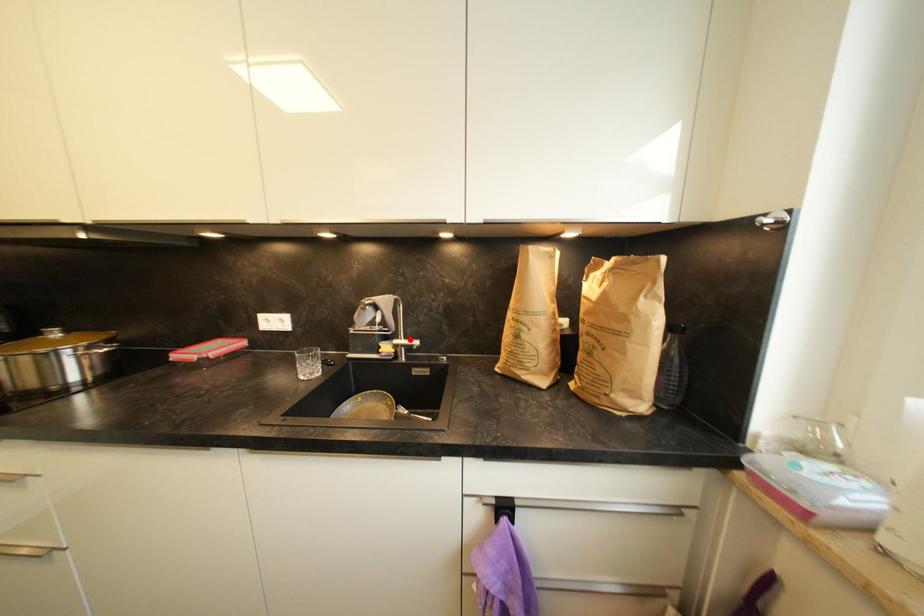
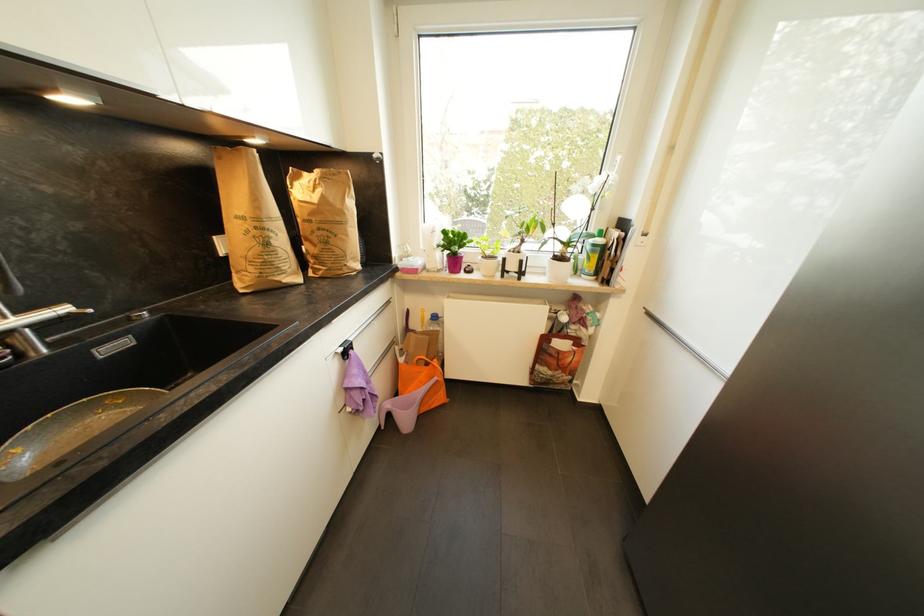
Find the pixel in the second image that matches the highlighted location in the first image.

(27, 313)